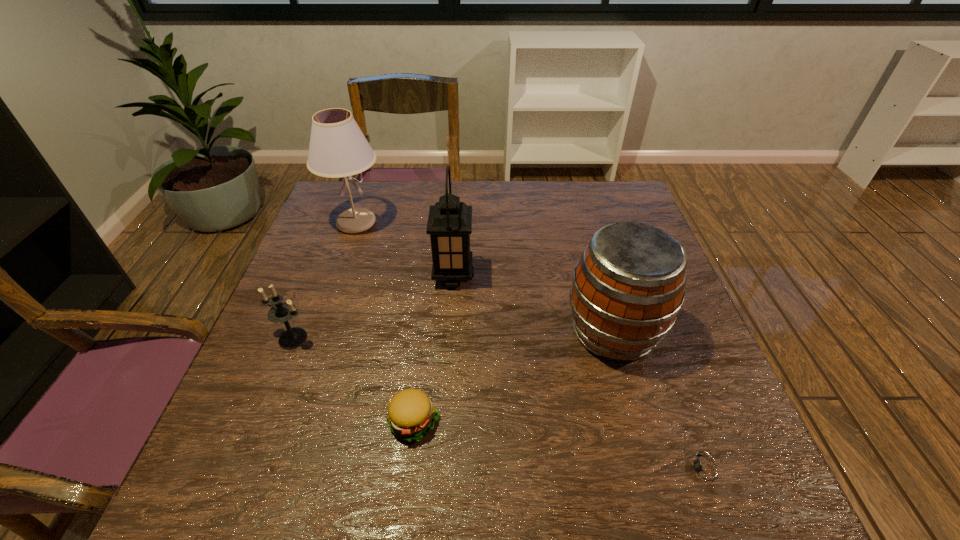
Identify the location of the farthest object. (338, 148).

Locate an element on the screen. This screenshot has width=960, height=540. lantern is located at coordinates (449, 224).

Find the location of a particular element. This screenshot has height=540, width=960. the fourth shortest object is located at coordinates (629, 285).

I want to click on candle holder, so click(x=282, y=312).

I want to click on hamburger, so click(411, 414).

The width and height of the screenshot is (960, 540). In order to click on watch in this screenshot , I will do `click(705, 470)`.

Find the location of `free region located 0.170m on the front of the farthest object`. free region located 0.170m on the front of the farthest object is located at coordinates (335, 284).

The width and height of the screenshot is (960, 540). I want to click on free space located on the back of the fifth nearest object, so click(457, 213).

I want to click on free point located on the left of the fourth shortest object, so click(502, 332).

I want to click on free space located 0.320m on the back of the candle holder, so click(x=331, y=240).